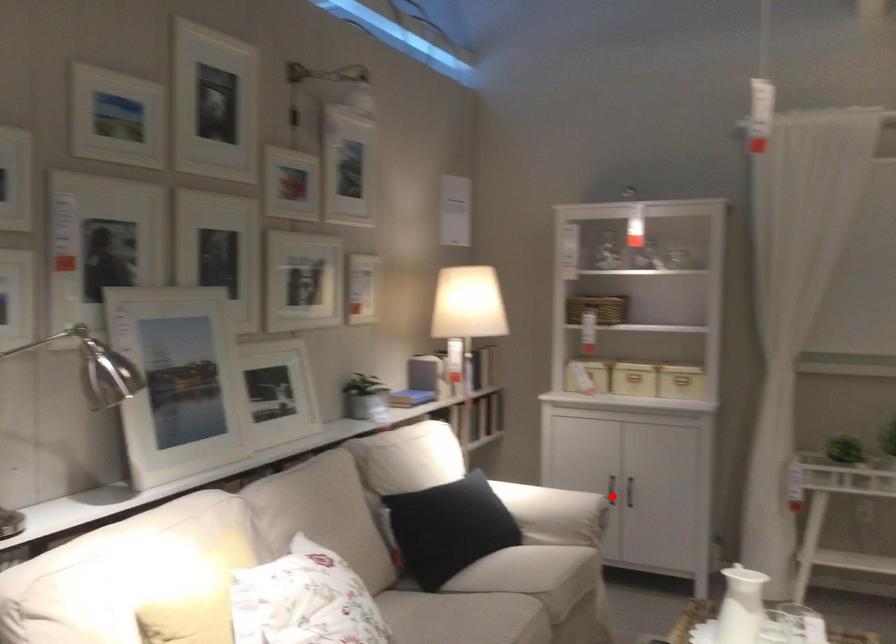
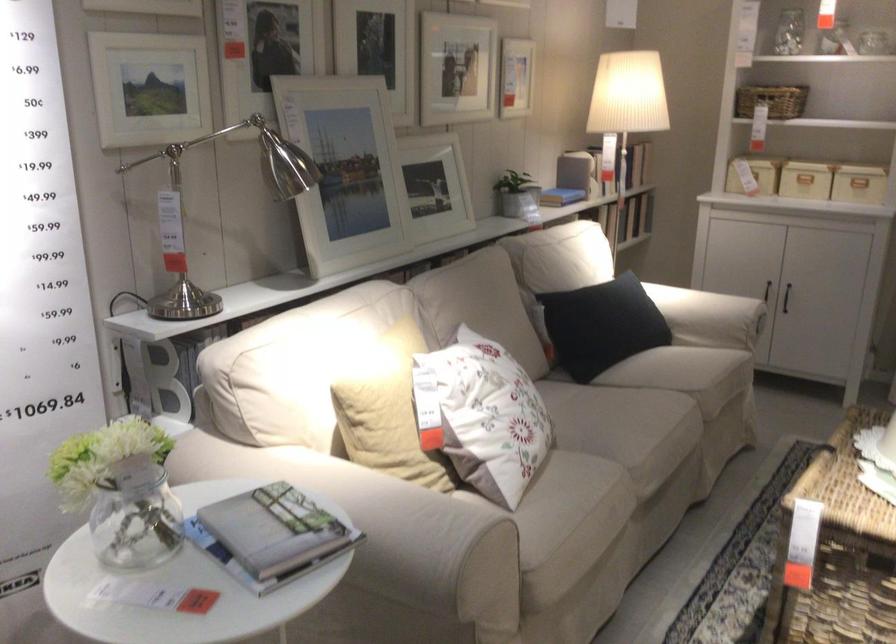
In the second image, find the point that corresponds to the highlighted location in the first image.

(765, 290)